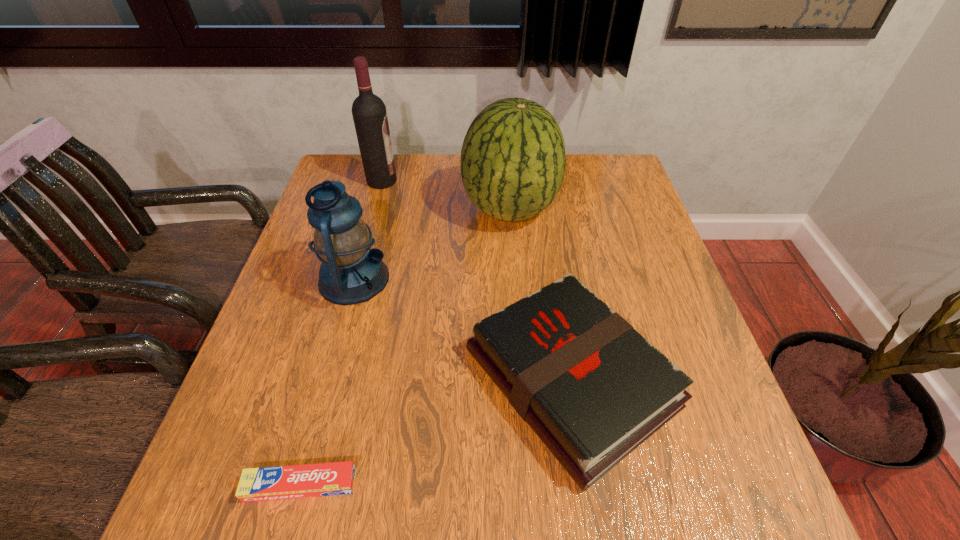
Where is `wine bottle situated at the far edge`? This screenshot has width=960, height=540. wine bottle situated at the far edge is located at coordinates (369, 113).

Find the location of a particular element. This screenshot has height=540, width=960. watermelon located at the far edge is located at coordinates (513, 159).

Find the location of a particular element. The height and width of the screenshot is (540, 960). hardback book located in the near edge section of the desktop is located at coordinates pos(593,389).

At what (x,y) coordinates should I click in order to perform the action: click on toothpaste located at the near edge. Please return your answer as a coordinate pair (x, y). The image size is (960, 540). Looking at the image, I should click on (336, 478).

Locate an element on the screen. This screenshot has height=540, width=960. wine bottle positioned at the left edge is located at coordinates (369, 113).

Where is `lantern situated at the left edge`? This screenshot has width=960, height=540. lantern situated at the left edge is located at coordinates (351, 272).

You are a GUI agent. You are given a task and a screenshot of the screen. Output one action in this format:
    pyautogui.click(x=<x>, y=<y>)
    Task: Click on the toothpaste that is at the left edge
    This screenshot has height=540, width=960.
    Given the screenshot: What is the action you would take?
    pyautogui.click(x=336, y=478)

This screenshot has height=540, width=960. What are the coordinates of `object that is at the right edge` in the screenshot? It's located at (593, 389).

In order to click on object located in the far left corner section of the desktop in this screenshot , I will do `click(369, 113)`.

I want to click on object present at the near left corner, so click(x=336, y=478).